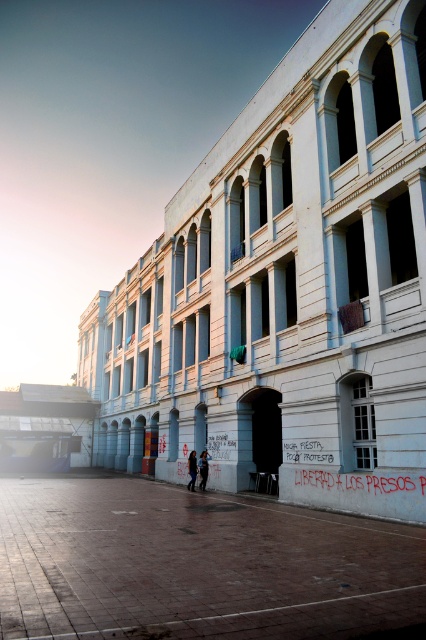
Where is `smooth concrete plaza at center`? Image resolution: width=426 pixels, height=640 pixels. smooth concrete plaza at center is located at coordinates (196, 564).

Can you confirm if smooth concrete plaza at center is shorter than blue denim jacket at center?

No, smooth concrete plaza at center is not shorter than blue denim jacket at center.

Between point (118, 577) and point (204, 484), which one is positioned in front?

Point (118, 577) is in front.

Image resolution: width=426 pixels, height=640 pixels. I want to click on smooth concrete plaza at center, so click(196, 564).

Identify the location of smooth concrete plaza at center. This screenshot has height=640, width=426. (196, 564).

Does smooth concrete plaza at center have a greater height compared to dark blue jeans at center?

Yes.

Is point (365, 528) positioned in front of point (192, 476)?

Yes, it is.

You are a GUI agent. You are given a task and a screenshot of the screen. Output one action in this format:
    pyautogui.click(x=<x>, y=<y>)
    Task: Click on the smooth concrete plaza at center
    
    Given the screenshot: What is the action you would take?
    pyautogui.click(x=196, y=564)

Does blue denim jacket at center appear over dark blue jeans at center?

Correct, blue denim jacket at center is located above dark blue jeans at center.

You are a GUI agent. You are given a task and a screenshot of the screen. Output one action in this format:
    pyautogui.click(x=<x>, y=<y>)
    Task: Click on the blue denim jacket at center
    The width and height of the screenshot is (426, 640).
    Given the screenshot: What is the action you would take?
    pyautogui.click(x=203, y=468)

The width and height of the screenshot is (426, 640). What do you see at coordinates (203, 468) in the screenshot? I see `blue denim jacket at center` at bounding box center [203, 468].

The width and height of the screenshot is (426, 640). I want to click on blue denim jacket at center, so click(203, 468).